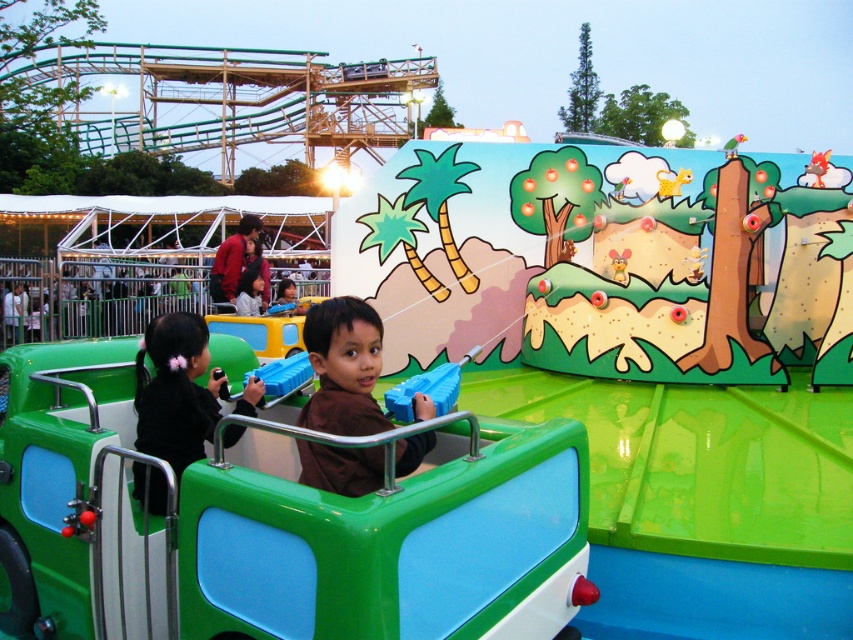
Looking at this image, is shiny plastic toy car at center to the right of black matte hair at center from the viewer's perspective?

Correct, you'll find shiny plastic toy car at center to the right of black matte hair at center.

Does point (68, 365) lie behind point (138, 442)?

Yes, point (68, 365) is behind point (138, 442).

The image size is (853, 640). Identify the location of shiny plastic toy car at center. (277, 525).

Between point (338, 353) and point (450, 380), which one is positioned in front?

Point (338, 353) is in front.

Who is more forward, (433, 435) or (433, 388)?

Point (433, 435) is in front.

Identify the location of brown matte shirt at center. The image size is (853, 640). (343, 368).

Is black matte hair at center to the right of blue plastic handle at center from the viewer's perspective?

No, black matte hair at center is not to the right of blue plastic handle at center.

Is black matte hair at center positioned at the back of blue plastic handle at center?

That is False.

At what (x,y) coordinates should I click in order to perform the action: click on black matte hair at center. Please return your answer as a coordinate pair (x, y). Looking at the image, I should click on (177, 390).